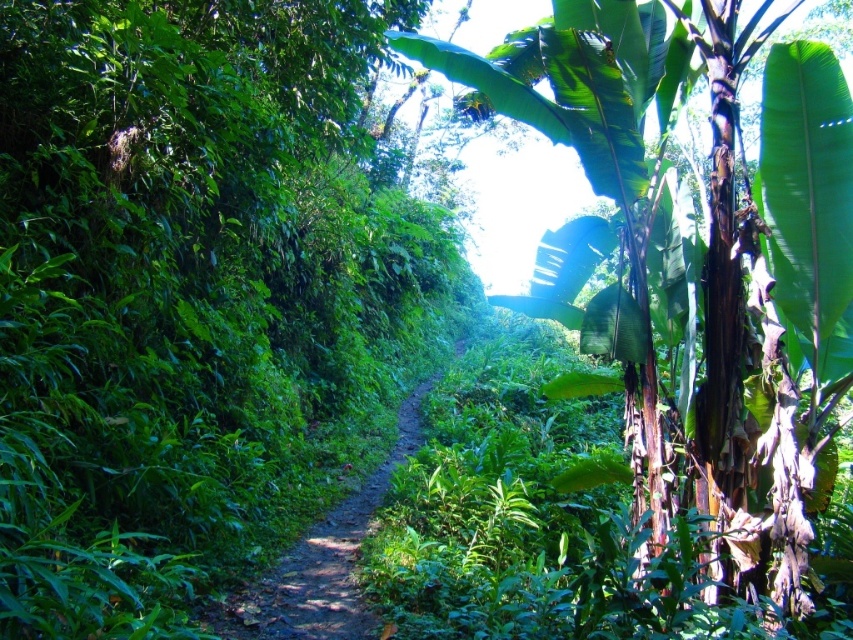
Can you confirm if green leafy banana tree at right is shorter than dirt path at center?

No, green leafy banana tree at right is not shorter than dirt path at center.

Can you confirm if green leafy banana tree at right is positioned to the right of dirt path at center?

Correct, you'll find green leafy banana tree at right to the right of dirt path at center.

Who is more forward, (604, 106) or (277, 600)?

Positioned in front is point (277, 600).

You are a GUI agent. You are given a task and a screenshot of the screen. Output one action in this format:
    pyautogui.click(x=<x>, y=<y>)
    Task: Click on the green leafy banana tree at right
    
    Given the screenshot: What is the action you would take?
    pyautogui.click(x=694, y=269)